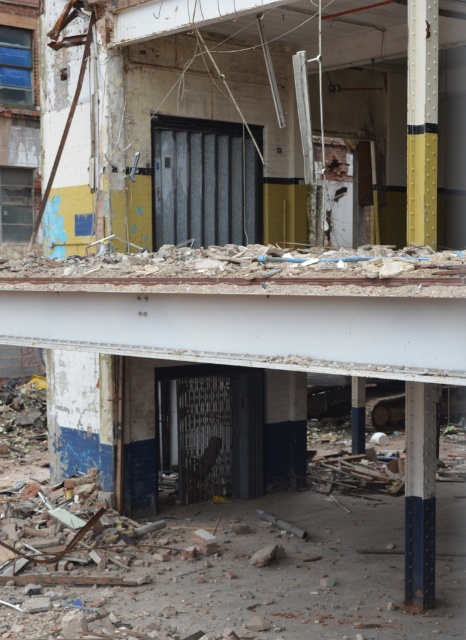
Between point (423, 26) and point (432, 557), which one is positioned behind?

The point (432, 557) is behind.

Measure the distance between point (416, 218) and camera.

10.74 meters

The width and height of the screenshot is (466, 640). What are the coordinates of `yellow painted metal pole at upper right` in the screenshot? It's located at (422, 122).